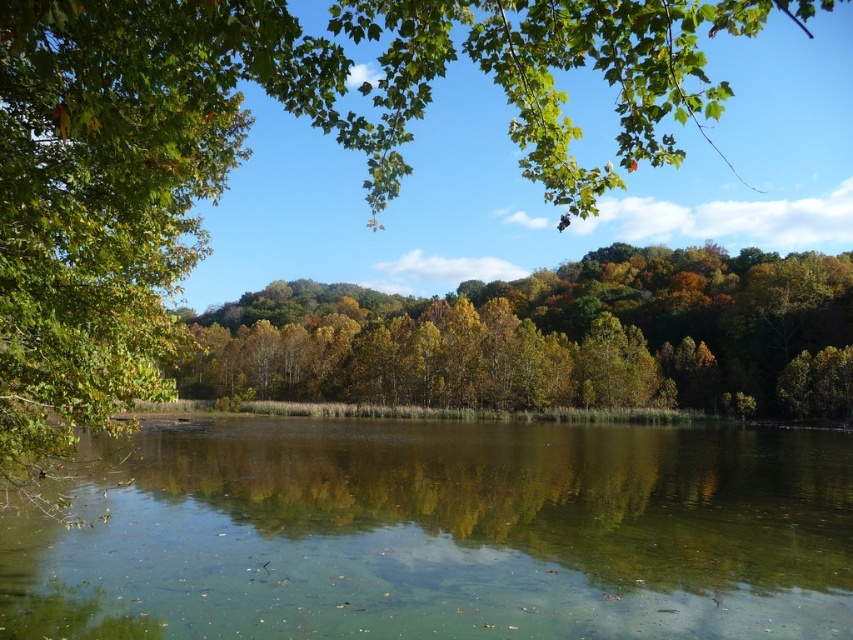
Question: Is the position of green translucent water at center less distant than that of green leafy trees at center?

Choices:
 (A) yes
 (B) no

Answer: (A)

Question: Can you confirm if green translucent water at center is thinner than green leafy trees at center?

Choices:
 (A) no
 (B) yes

Answer: (B)

Question: Can you confirm if green translucent water at center is positioned to the left of green leafy trees at center?

Choices:
 (A) yes
 (B) no

Answer: (B)

Question: Which of the following is the farthest from the observer?

Choices:
 (A) (532, 356)
 (B) (212, 627)

Answer: (A)

Question: Which point appears closest to the camera in this image?

Choices:
 (A) (547, 384)
 (B) (265, 556)

Answer: (B)